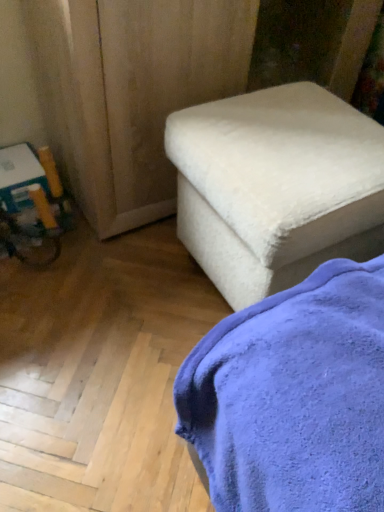
Measure the distance between point (263, 90) and camera.

38.98 inches.

Where is `white fuzzy ottoman at center`? This screenshot has height=512, width=384. white fuzzy ottoman at center is located at coordinates (276, 186).

Describe the element at coordinates (276, 186) in the screenshot. I see `white fuzzy ottoman at center` at that location.

Measure the distance between white fuzzy ottoman at center and camera.

A distance of 27.11 inches exists between white fuzzy ottoman at center and camera.

Locate an element on the screen. This screenshot has height=512, width=384. white fuzzy ottoman at center is located at coordinates (276, 186).